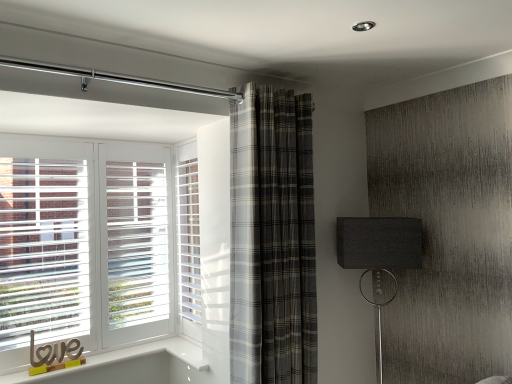
Question: Does plaid fabric curtain at center have a smaller size compared to white textured screen door at center?

Choices:
 (A) no
 (B) yes

Answer: (A)

Question: Is plaid fabric curtain at center at the left side of white textured screen door at center?

Choices:
 (A) yes
 (B) no

Answer: (B)

Question: Can you confirm if plaid fabric curtain at center is shorter than white textured screen door at center?

Choices:
 (A) no
 (B) yes

Answer: (A)

Question: Is there a large distance between plaid fabric curtain at center and white textured screen door at center?

Choices:
 (A) yes
 (B) no

Answer: (B)

Question: Considering the relative positions of plaid fabric curtain at center and white textured screen door at center in the image provided, is plaid fabric curtain at center in front of white textured screen door at center?

Choices:
 (A) yes
 (B) no

Answer: (A)

Question: Could you tell me if plaid fabric curtain at center is turned towards white textured screen door at center?

Choices:
 (A) no
 (B) yes

Answer: (A)

Question: Is white textured screen door at center not inside plaid fabric curtain at center?

Choices:
 (A) yes
 (B) no

Answer: (A)

Question: Can you confirm if white textured screen door at center is smaller than plaid fabric curtain at center?

Choices:
 (A) no
 (B) yes

Answer: (B)

Question: Is white textured screen door at center not near plaid fabric curtain at center?

Choices:
 (A) no
 (B) yes

Answer: (A)

Question: From a real-world perspective, is white textured screen door at center positioned over plaid fabric curtain at center based on gravity?

Choices:
 (A) no
 (B) yes

Answer: (A)

Question: Can you confirm if white textured screen door at center is positioned to the left of plaid fabric curtain at center?

Choices:
 (A) no
 (B) yes

Answer: (B)

Question: Would you say plaid fabric curtain at center is part of white textured screen door at center's contents?

Choices:
 (A) yes
 (B) no

Answer: (B)

Question: Is matte black lampshade at right smaller than plaid fabric curtain at center?

Choices:
 (A) yes
 (B) no

Answer: (A)